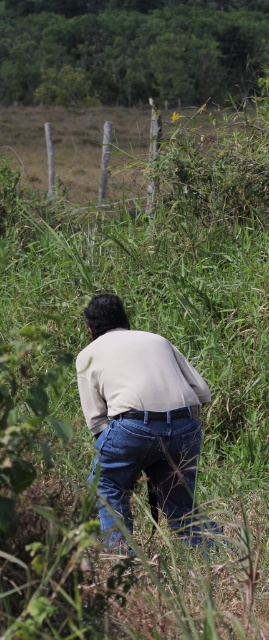
Question: Where is green grass at upper center located in relation to light beige shirt at center in the image?

Choices:
 (A) right
 (B) left

Answer: (B)

Question: Among these objects, which one is nearest to the camera?

Choices:
 (A) light beige shirt at center
 (B) green grass at upper center

Answer: (A)

Question: Which of the following is the closest to the observer?

Choices:
 (A) light beige shirt at center
 (B) green grass at upper center
 (C) blue denim jeans at center

Answer: (C)

Question: Considering the relative positions of light beige shirt at center and blue denim jeans at center in the image provided, where is light beige shirt at center located with respect to blue denim jeans at center?

Choices:
 (A) left
 (B) right

Answer: (A)

Question: Is green grass at upper center positioned behind blue denim jeans at center?

Choices:
 (A) no
 (B) yes

Answer: (B)

Question: Which point is farther to the camera?

Choices:
 (A) (93, 404)
 (B) (115, 451)
 (C) (182, 10)

Answer: (C)